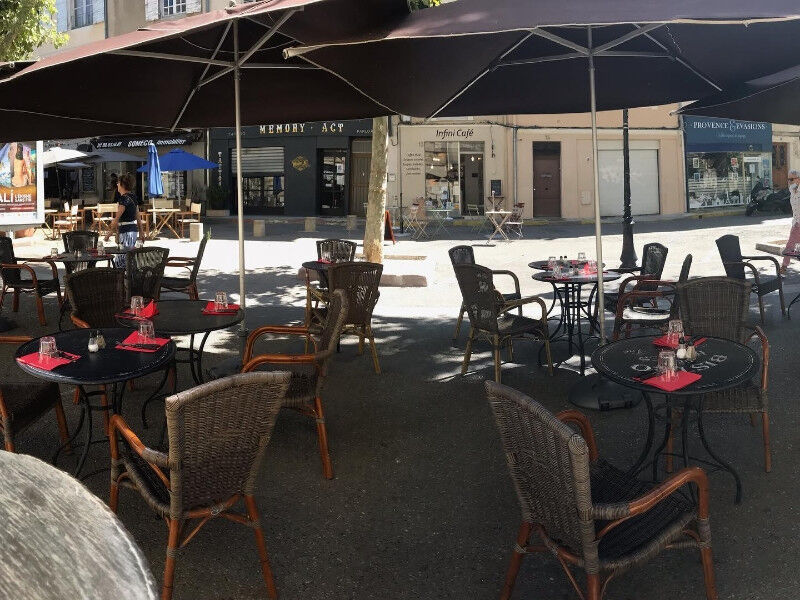
At what (x,y) coordinates should I click in order to perform the action: click on cups. Please return your answer as a coordinate pair (x, y). This screenshot has height=600, width=800. Looking at the image, I should click on (50, 346), (145, 325).